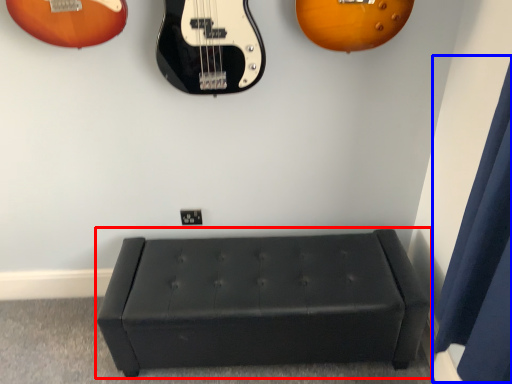
Question: Which object is closer to the camera taking this photo, furniture (highlighted by a red box) or curtain (highlighted by a blue box)?

Choices:
 (A) furniture
 (B) curtain

Answer: (B)